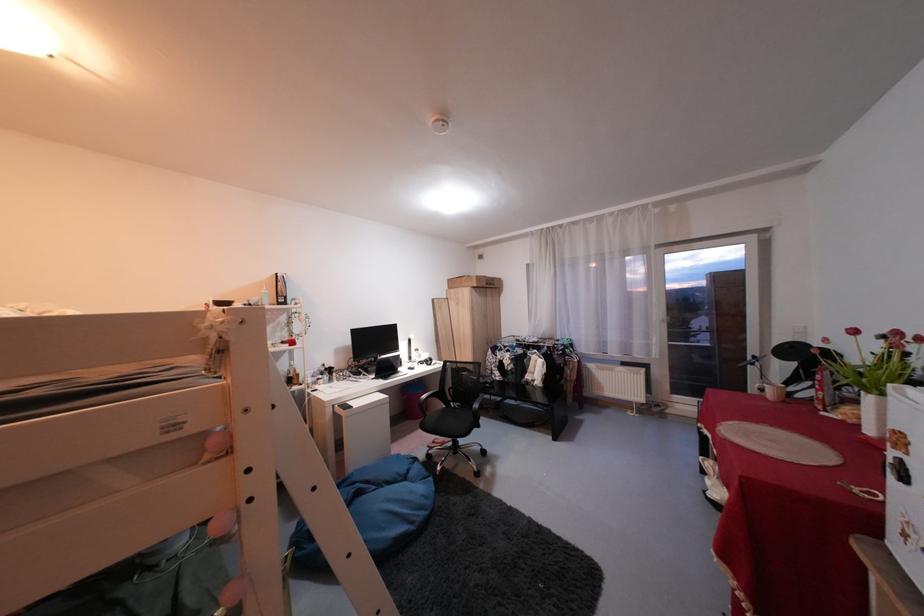
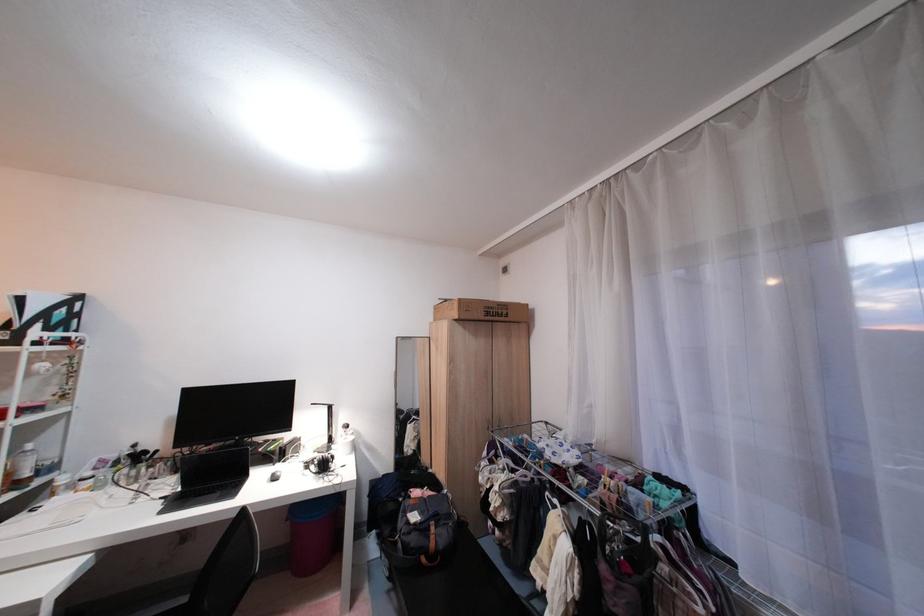
Find the pixel in the second image that matches point 488,278 in the first image.

(470, 302)